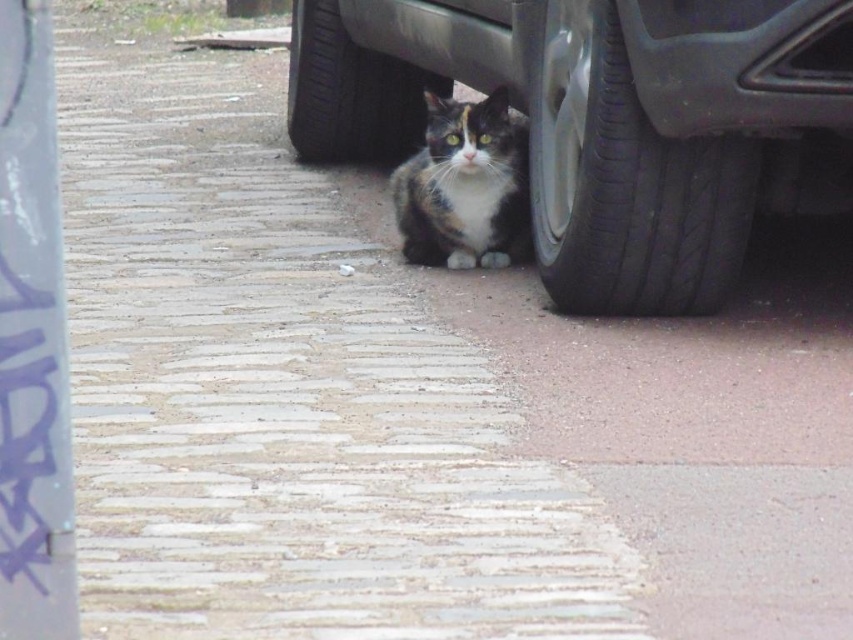
You are a delivery person trying to park your vehicle on the driveway. You see the black rubber tire at lower right and the calico fur cat at center. Which object is bigger in size?

The black rubber tire at lower right has a larger size compared to calico fur cat at center, so the black rubber tire at lower right is bigger.

You are a delivery person trying to reach the front door located behind the metallic gray car at lower center. The path to the door is blocked by the calico fur cat at center. Can you safely drive around the cat without hitting it?

The metallic gray car at lower center is wider than the calico fur cat at center, so you can safely drive around the cat as long as you stay within the car width. However, ensure the cat moves out of the way before proceeding.

You are a delivery person trying to park your vehicle on the paved driveway. You notice the calico fur cat at center and the black rubber tire at lower right. Based on their positions, is the cat in a safe spot away from the tire?

The black rubber tire at lower right is in front of the calico fur cat at center, which means the cat is behind the tire and not in a safe spot. The tire is closer to the front of the vehicle, so the cat might be in a dangerous position if the vehicle moves.